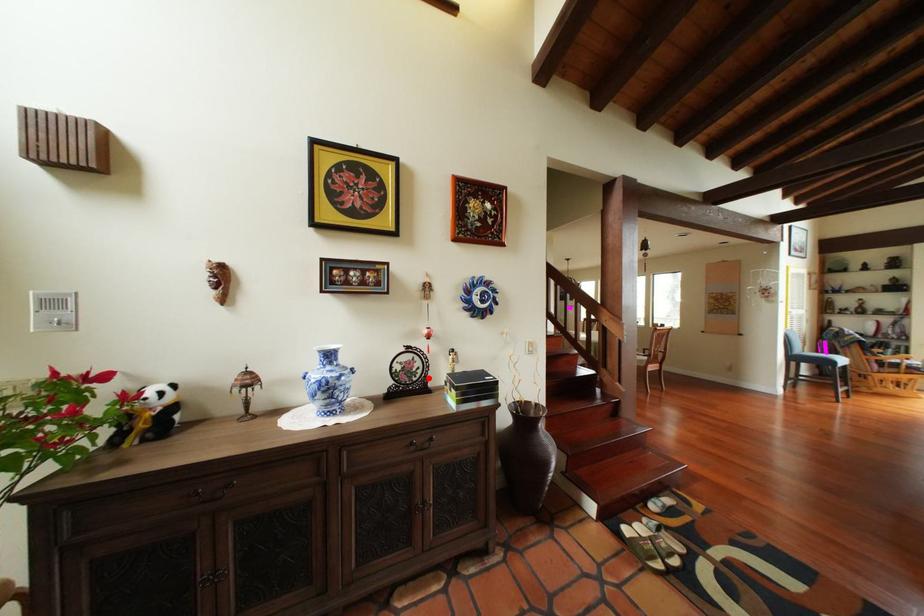
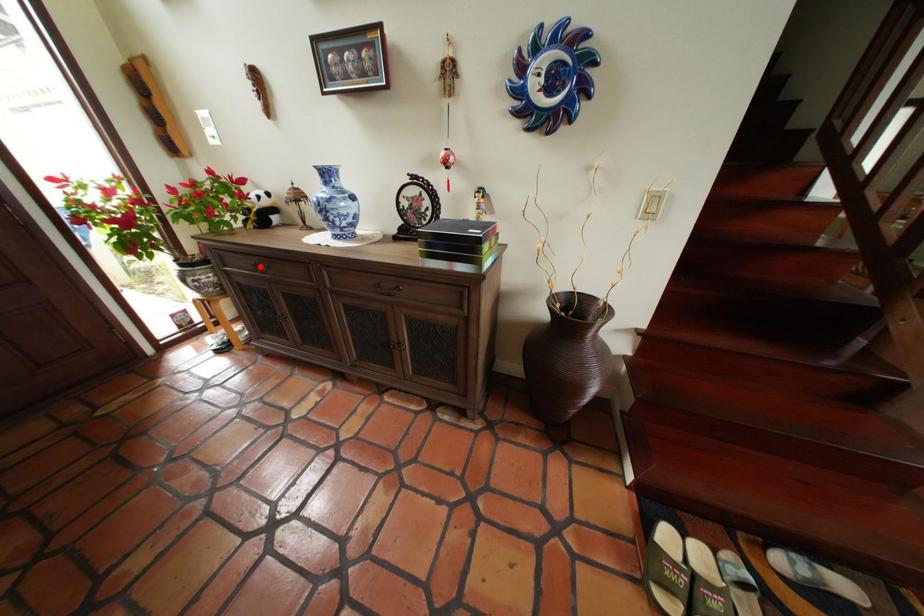
From the picture: I am providing you with two images of the same scene from different viewpoints. A red point is marked on the first image and another point is marked on the second image. Are the points marked in image1 and image2 representing the same 3D position?

No